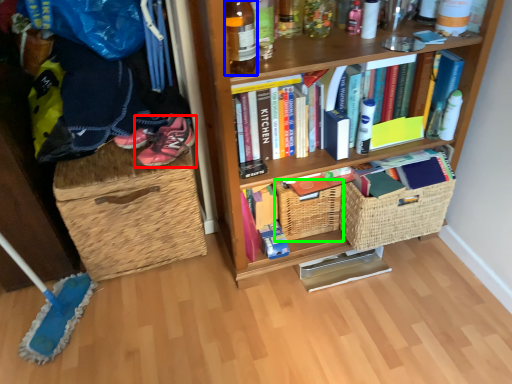
Question: Which object is the farthest from footwear (highlighted by a red box)? Choose among these: bottle (highlighted by a blue box) or basket (highlighted by a green box).

Choices:
 (A) bottle
 (B) basket

Answer: (A)